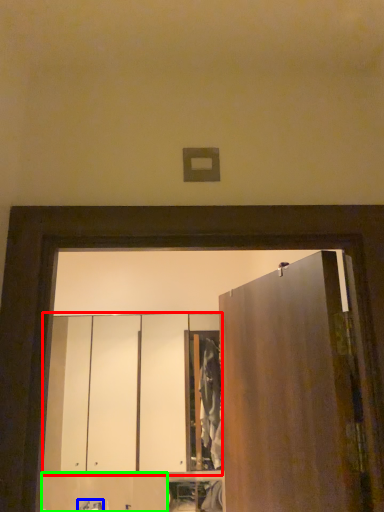
Question: Estimate the real-world distances between objects in this image. Which object is closer to cabinetry (highlighted by a red box), faucet (highlighted by a blue box) or cabinetry (highlighted by a green box)?

Choices:
 (A) faucet
 (B) cabinetry

Answer: (B)